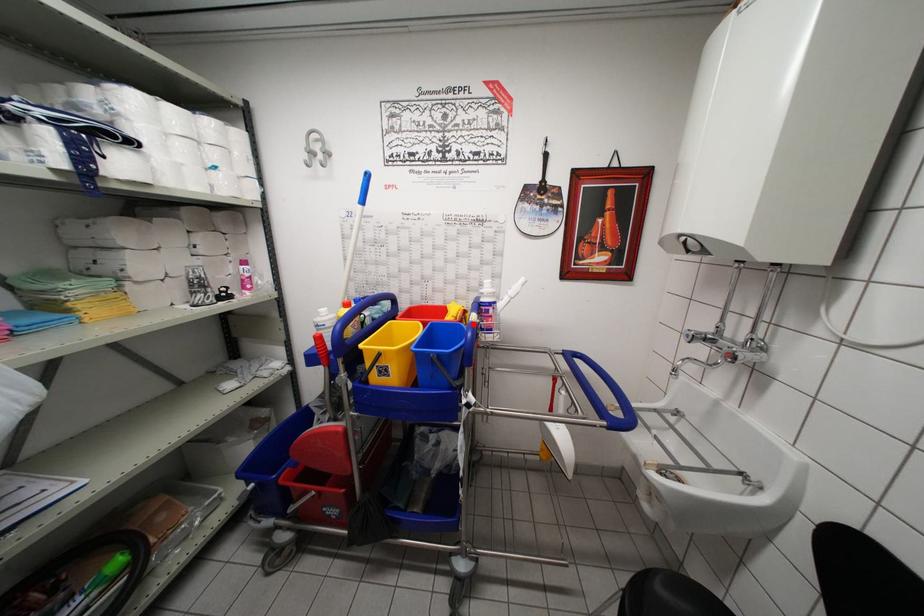
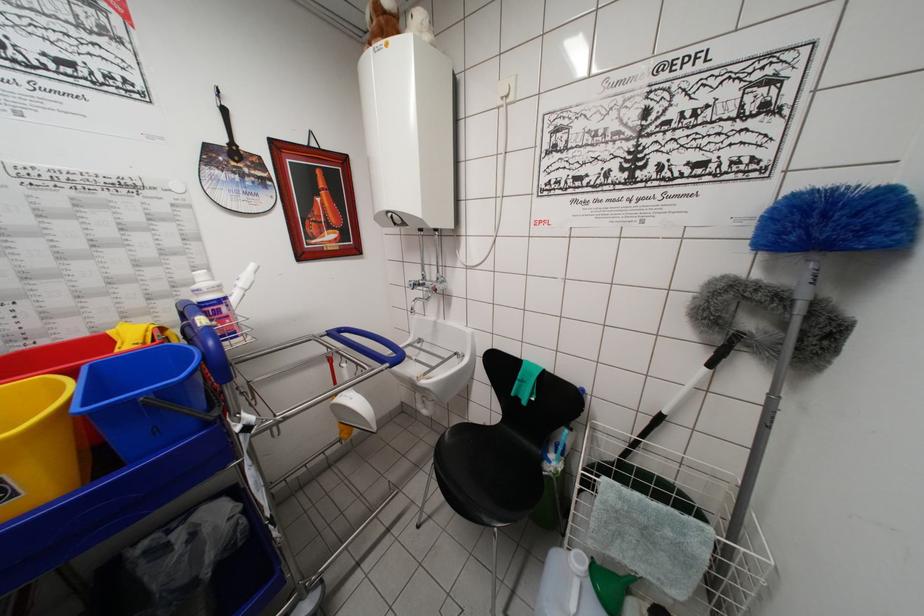
In the second image, find the point that corresponds to the highlighted location in the first image.

(202, 330)